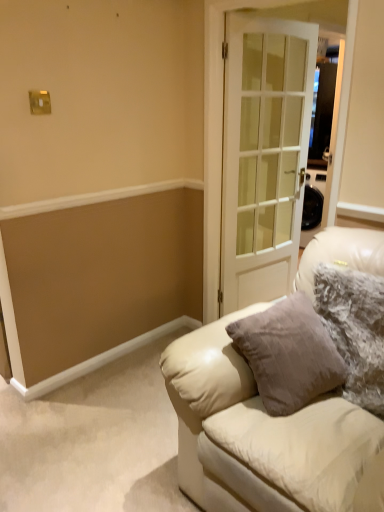
Question: Considering the positions of point (292, 111) and point (210, 332), is point (292, 111) closer or farther from the camera than point (210, 332)?

Choices:
 (A) closer
 (B) farther

Answer: (B)

Question: Is white glass door at center inside or outside of leather couch at center?

Choices:
 (A) inside
 (B) outside

Answer: (B)

Question: Which object is positioned closest to the white glass door at center?

Choices:
 (A) leather couch at center
 (B) fuzzy fabric pillow at right

Answer: (B)

Question: Estimate the real-world distances between objects in this image. Which object is closer to the fuzzy fabric pillow at right?

Choices:
 (A) white glass door at center
 (B) leather couch at center

Answer: (B)